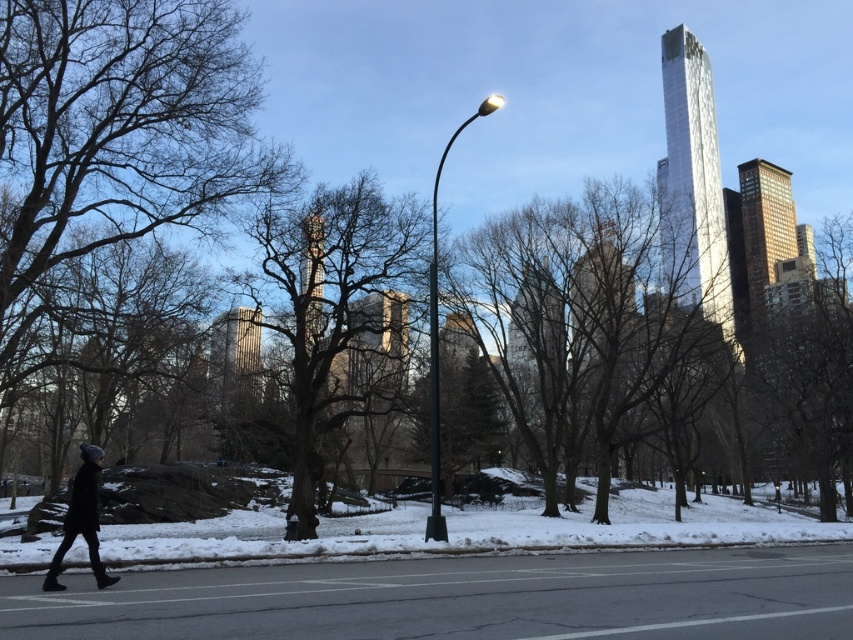
You are a photographer trying to capture the winter scene. You notice the bare branches at left and the black woolen hat at lower left in your viewfinder. Which object appears smaller in the photo?

The bare branches at left appears smaller in the photo compared to the black woolen hat at lower left because the description states that the bare branches at left has a smaller size compared to the black woolen hat at lower left.

You are a delivery robot with a 1.5 meter wide package. You need to travel from the smooth brown tree at center to the black woolen hat at lower left. Is there enough space between them for you and your package to pass through?

The distance between the smooth brown tree at center and the black woolen hat at lower left is 21.33 meters, which is more than enough space for the delivery robot and its 1.5 meter wide package to pass through safely.